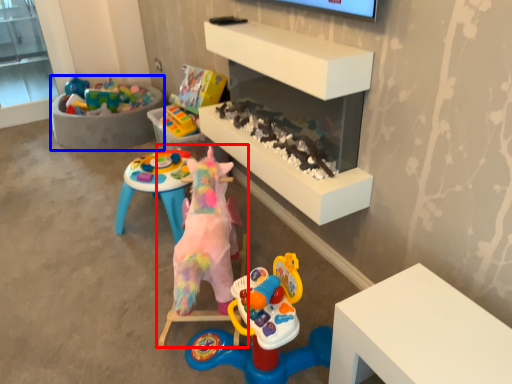
Question: Which of the following is the farthest to the observer, toy (highlighted by a red box) or furniture (highlighted by a blue box)?

Choices:
 (A) toy
 (B) furniture

Answer: (B)